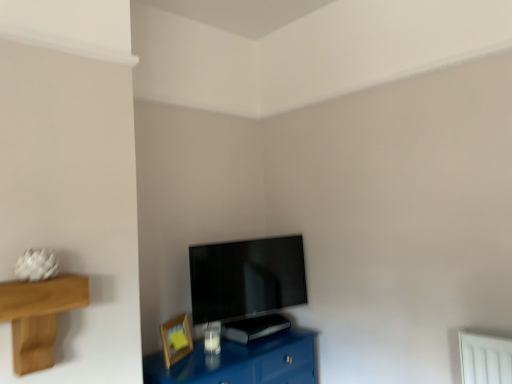
In order to face glossy blue table at lower center, should I rotate leftwards or rightwards?

Turn left by 2.985 degrees to look at glossy blue table at lower center.

The height and width of the screenshot is (384, 512). What do you see at coordinates (176, 339) in the screenshot? I see `wooden picture frame at lower left` at bounding box center [176, 339].

What do you see at coordinates (246, 277) in the screenshot?
I see `flat screen tv at center` at bounding box center [246, 277].

Where is `glossy blue table at lower center`? The height and width of the screenshot is (384, 512). glossy blue table at lower center is located at coordinates (242, 362).

Considering the sizes of objects glossy blue table at lower center and flat screen tv at center in the image provided, who is bigger, glossy blue table at lower center or flat screen tv at center?

With larger size is glossy blue table at lower center.

Is glossy blue table at lower center next to flat screen tv at center?

There is a gap between glossy blue table at lower center and flat screen tv at center.

Between glossy blue table at lower center and flat screen tv at center, which one has larger width?

With larger width is glossy blue table at lower center.

Find the location of `table that is in front of the flat screen tv at center`. table that is in front of the flat screen tv at center is located at coordinates (242, 362).

Between wooden picture frame at lower left and glossy blue table at lower center, which one has smaller width?

With smaller width is wooden picture frame at lower left.

Which is closer to the camera, (179, 340) or (288, 350)?

Point (179, 340)

Which object is positioned more to the left, wooden picture frame at lower left or glossy blue table at lower center?

From the viewer's perspective, wooden picture frame at lower left appears more on the left side.

Based on the photo, can you tell me how much glossy blue table at lower center and wooden picture frame at lower left differ in facing direction?

glossy blue table at lower center and wooden picture frame at lower left are facing 27.8 degrees away from each other.

Considering the positions of points (216, 382) and (185, 345), is point (216, 382) closer to camera compared to point (185, 345)?

Yes, it is in front of point (185, 345).

Considering the relative sizes of glossy blue table at lower center and wooden picture frame at lower left in the image provided, is glossy blue table at lower center bigger than wooden picture frame at lower left?

Correct, glossy blue table at lower center is larger in size than wooden picture frame at lower left.

How much distance is there between glossy blue table at lower center and wooden picture frame at lower left?

A distance of 10.12 inches exists between glossy blue table at lower center and wooden picture frame at lower left.

Could you tell me if flat screen tv at center is facing wooden picture frame at lower left?

No, flat screen tv at center does not turn towards wooden picture frame at lower left.

Can you confirm if flat screen tv at center is shorter than wooden picture frame at lower left?

Incorrect, the height of flat screen tv at center does not fall short of that of wooden picture frame at lower left.

Is flat screen tv at center to the left or to the right of wooden picture frame at lower left in the image?

flat screen tv at center is to the right of wooden picture frame at lower left.

Is wooden picture frame at lower left facing towards flat screen tv at center?

No, wooden picture frame at lower left is not aimed at flat screen tv at center.

Can you confirm if wooden picture frame at lower left is positioned to the left of flat screen tv at center?

Yes.

Consider the image. Looking at their sizes, would you say wooden picture frame at lower left is wider or thinner than flat screen tv at center?

In the image, wooden picture frame at lower left appears to be more narrow than flat screen tv at center.

This screenshot has width=512, height=384. Find the location of `table that is under the flat screen tv at center (from a real-world perspective)`. table that is under the flat screen tv at center (from a real-world perspective) is located at coordinates (242, 362).

Is flat screen tv at center facing away from glossy blue table at lower center?

No, glossy blue table at lower center is not at the back of flat screen tv at center.

Between point (283, 244) and point (243, 380), which one is positioned behind?

The point (283, 244) is more distant.

Is flat screen tv at center next to glossy blue table at lower center and touching it?

No, flat screen tv at center is not in contact with glossy blue table at lower center.

Locate an element on the screen. The image size is (512, 384). television lying on the right of glossy blue table at lower center is located at coordinates (246, 277).

In order to click on picture frame that is above the glossy blue table at lower center (from a real-world perspective) in this screenshot , I will do `click(176, 339)`.

Looking at the image, which one is located further to glossy blue table at lower center, wooden picture frame at lower left or flat screen tv at center?

flat screen tv at center is further to glossy blue table at lower center.

Considering their positions, is glossy blue table at lower center positioned further to wooden picture frame at lower left than flat screen tv at center?

flat screen tv at center is further to wooden picture frame at lower left.

Which object lies further to the anchor point flat screen tv at center, glossy blue table at lower center or wooden picture frame at lower left?

Based on the image, wooden picture frame at lower left appears to be further to flat screen tv at center.

Estimate the real-world distances between objects in this image. Which object is further from flat screen tv at center, wooden picture frame at lower left or glossy blue table at lower center?

Based on the image, wooden picture frame at lower left appears to be further to flat screen tv at center.

When comparing their distances from glossy blue table at lower center, does flat screen tv at center or wooden picture frame at lower left seem further?

The object further to glossy blue table at lower center is flat screen tv at center.

Based on their spatial positions, is flat screen tv at center or glossy blue table at lower center closer to wooden picture frame at lower left?

Among the two, glossy blue table at lower center is located nearer to wooden picture frame at lower left.

Find the location of a particular element. The image size is (512, 384). picture frame between glossy blue table at lower center and flat screen tv at center from front to back is located at coordinates (176, 339).